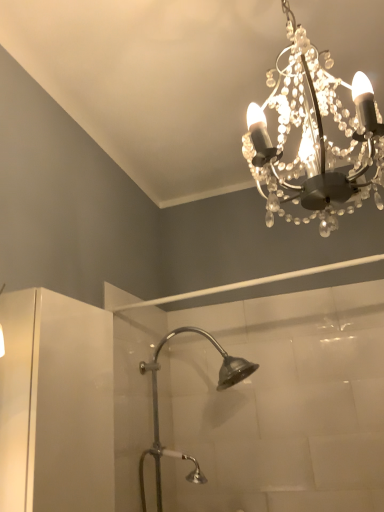
The height and width of the screenshot is (512, 384). Identify the location of silver metallic shower head at center. (217, 389).

Measure the distance between point (160,482) and camera.

Point (160,482) and camera are 6.48 feet apart.

This screenshot has width=384, height=512. Describe the element at coordinates (217, 389) in the screenshot. I see `silver metallic shower head at center` at that location.

You are a GUI agent. You are given a task and a screenshot of the screen. Output one action in this format:
    pyautogui.click(x=<x>, y=<y>)
    Task: Click on the clear crystal chandelier at upper center
    
    Given the screenshot: What is the action you would take?
    click(x=313, y=136)

This screenshot has height=512, width=384. Describe the element at coordinates (313, 136) in the screenshot. I see `clear crystal chandelier at upper center` at that location.

The height and width of the screenshot is (512, 384). I want to click on silver metallic shower head at center, so click(x=217, y=389).

Is silver metallic shower head at center at the left side of clear crystal chandelier at upper center?

Yes.

Considering the positions of objects silver metallic shower head at center and clear crystal chandelier at upper center in the image provided, who is behind, silver metallic shower head at center or clear crystal chandelier at upper center?

silver metallic shower head at center is further from the camera.

Which is further, (153,446) or (301,117)?

The point (153,446) is farther.

From the image's perspective, between silver metallic shower head at center and clear crystal chandelier at upper center, who is located below?

silver metallic shower head at center appears lower in the image.

In the scene shown: From a real-world perspective, who is located higher, silver metallic shower head at center or clear crystal chandelier at upper center?

In real-world perspective, clear crystal chandelier at upper center is above.

Considering the sizes of objects silver metallic shower head at center and clear crystal chandelier at upper center in the image provided, who is wider, silver metallic shower head at center or clear crystal chandelier at upper center?

silver metallic shower head at center.

Which of these two, silver metallic shower head at center or clear crystal chandelier at upper center, stands shorter?

clear crystal chandelier at upper center.

Does silver metallic shower head at center have a larger size compared to clear crystal chandelier at upper center?

Indeed, silver metallic shower head at center has a larger size compared to clear crystal chandelier at upper center.

Is silver metallic shower head at center completely or partially outside of clear crystal chandelier at upper center?

Yes, silver metallic shower head at center is not within clear crystal chandelier at upper center.

Consider the image. Is there a large distance between silver metallic shower head at center and clear crystal chandelier at upper center?

Yes, silver metallic shower head at center and clear crystal chandelier at upper center are quite far apart.

Is silver metallic shower head at center oriented towards clear crystal chandelier at upper center?

No.

Looking at this image, what's the angular difference between silver metallic shower head at center and clear crystal chandelier at upper center's facing directions?

They differ by 90.1 degrees in their facing directions.

Measure the distance between silver metallic shower head at center and clear crystal chandelier at upper center.

A distance of 4.22 feet exists between silver metallic shower head at center and clear crystal chandelier at upper center.

The image size is (384, 512). Identify the location of shower below the clear crystal chandelier at upper center (from the image's perspective). (217, 389).

Can you confirm if clear crystal chandelier at upper center is positioned to the right of silver metallic shower head at center?

Yes.

Considering their positions, is clear crystal chandelier at upper center located in front of or behind silver metallic shower head at center?

In the image, clear crystal chandelier at upper center appears in front of silver metallic shower head at center.

Which is in front, point (359, 104) or point (194, 460)?

The point (359, 104) is closer.

Based on the photo, from the image's perspective, which one is positioned higher, clear crystal chandelier at upper center or silver metallic shower head at center?

clear crystal chandelier at upper center appears higher in the image.

From a real-world perspective, is clear crystal chandelier at upper center above or below silver metallic shower head at center?

Clearly, from a real-world perspective, clear crystal chandelier at upper center is above silver metallic shower head at center.

Is clear crystal chandelier at upper center thinner than silver metallic shower head at center?

Correct, the width of clear crystal chandelier at upper center is less than that of silver metallic shower head at center.

From their relative heights in the image, would you say clear crystal chandelier at upper center is taller or shorter than silver metallic shower head at center?

In the image, clear crystal chandelier at upper center appears to be shorter than silver metallic shower head at center.

Considering the relative sizes of clear crystal chandelier at upper center and silver metallic shower head at center in the image provided, is clear crystal chandelier at upper center smaller than silver metallic shower head at center?

Correct, clear crystal chandelier at upper center occupies less space than silver metallic shower head at center.

Does clear crystal chandelier at upper center contain silver metallic shower head at center?

No, silver metallic shower head at center is not surrounded by clear crystal chandelier at upper center.

Is clear crystal chandelier at upper center positioned far away from silver metallic shower head at center?

clear crystal chandelier at upper center is far away from silver metallic shower head at center.

Is clear crystal chandelier at upper center facing towards silver metallic shower head at center?

No, clear crystal chandelier at upper center does not turn towards silver metallic shower head at center.

How different are the orientations of clear crystal chandelier at upper center and silver metallic shower head at center in degrees?

90.1 degrees separate the facing orientations of clear crystal chandelier at upper center and silver metallic shower head at center.

How far apart are clear crystal chandelier at upper center and silver metallic shower head at center?

1.29 meters.

Identify the location of lamp to the right of silver metallic shower head at center. The width and height of the screenshot is (384, 512). (313, 136).

Where is `lamp above the silver metallic shower head at center (from a real-world perspective)`? lamp above the silver metallic shower head at center (from a real-world perspective) is located at coordinates (313, 136).

Where is `lamp on the right of the silver metallic shower head at center`? This screenshot has width=384, height=512. lamp on the right of the silver metallic shower head at center is located at coordinates (313, 136).